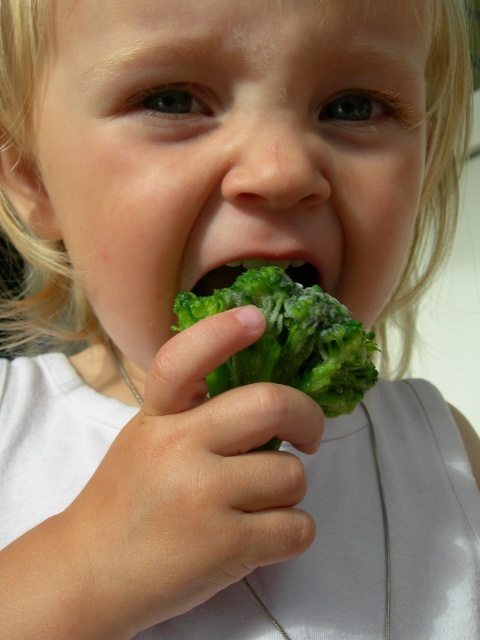
Question: Is the position of green matte broccoli at center more distant than that of green matte broccoli at mouth?

Choices:
 (A) no
 (B) yes

Answer: (A)

Question: Does green matte broccoli at center appear on the left side of green matte broccoli at mouth?

Choices:
 (A) yes
 (B) no

Answer: (B)

Question: Does green matte broccoli at center appear over green matte broccoli at mouth?

Choices:
 (A) no
 (B) yes

Answer: (A)

Question: Among these points, which one is nearest to the camera?

Choices:
 (A) (324, 374)
 (B) (216, 269)

Answer: (A)